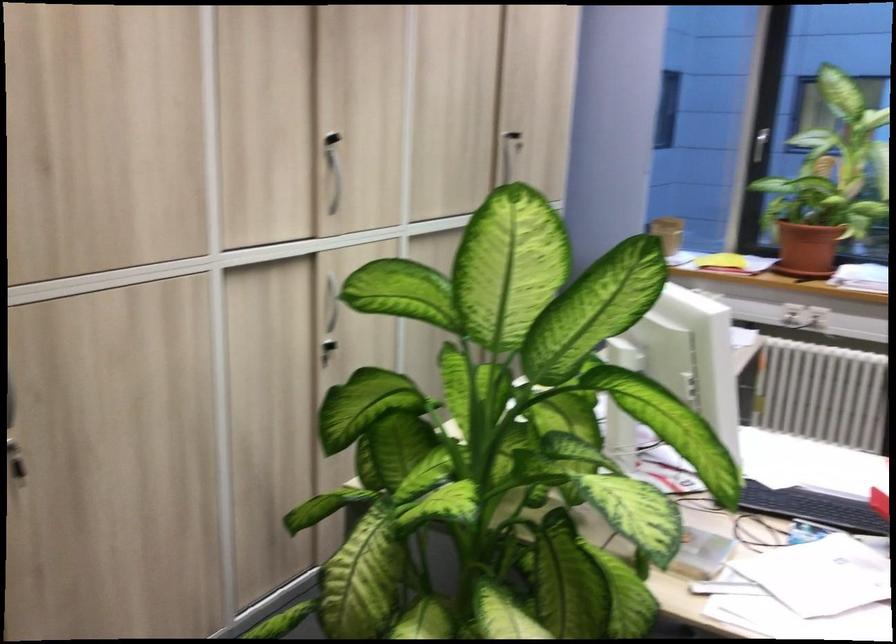
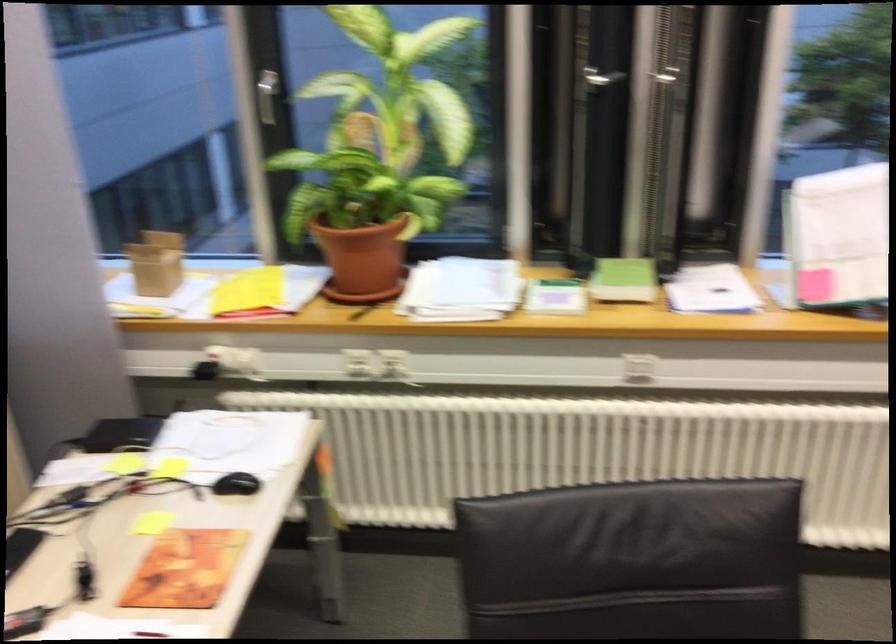
The point at (659, 232) is marked in the first image. Where is the corresponding point in the second image?

(156, 263)